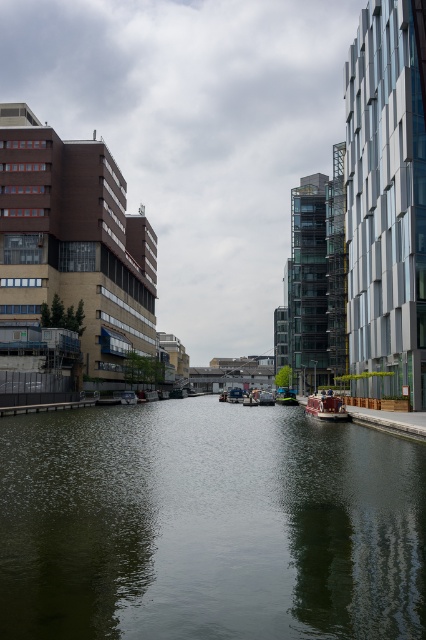
You are standing on a bridge overlooking the canal and see the green reflective water at center and the wooden polished boat at center. Which object is positioned to the left side from your viewpoint?

The green reflective water at center is to the left of the wooden polished boat at center from the observer viewpoint.

From the picture: You are standing on the wooden polished boat at center and want to know if you can move sideways without touching the green reflective water at center. Can you do that?

The green reflective water at center might be wider than wooden polished boat at center, so there is a possibility that the boat can move sideways without touching the water. However, since the exact width difference is uncertain, it is recommended to proceed with caution.